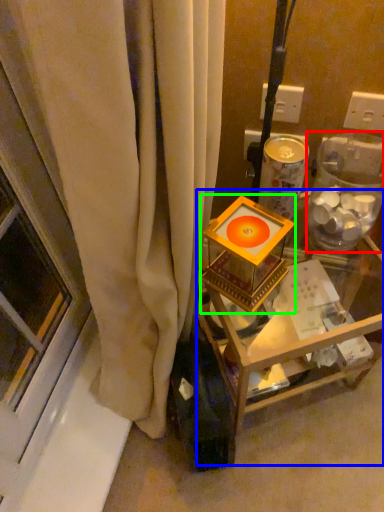
Question: Based on their relative distances, which object is nearer to glass box (highlighted by a red box)? Choose from furniture (highlighted by a blue box) and candle holder (highlighted by a green box).

Choices:
 (A) furniture
 (B) candle holder

Answer: (B)